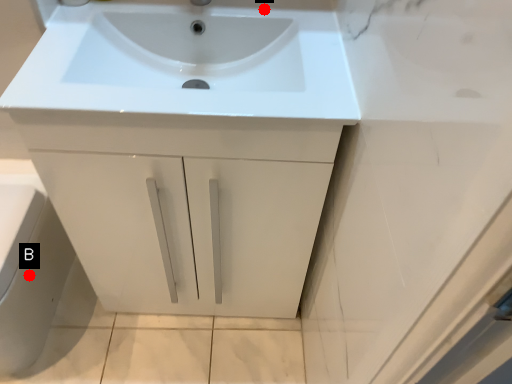
Question: Two points are circled on the image, labeled by A and B beside each circle. Which point is closer to the camera?

Choices:
 (A) A is closer
 (B) B is closer

Answer: (A)